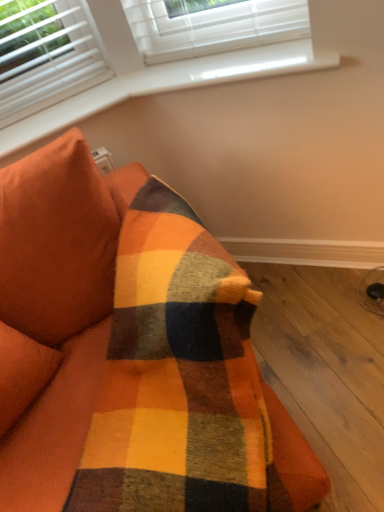
From the picture: What is the approximate width of plaid wool blanket at center?

3.43 feet.

The height and width of the screenshot is (512, 384). In order to click on plaid wool blanket at center in this screenshot , I will do `click(136, 352)`.

Measure the distance between point (88, 331) and camera.

The depth of point (88, 331) is 1.20 meters.

What is the approximate height of plaid wool blanket at center?

It is 34.29 inches.

What do you see at coordinates (136, 352) in the screenshot? The image size is (384, 512). I see `plaid wool blanket at center` at bounding box center [136, 352].

You are a GUI agent. You are given a task and a screenshot of the screen. Output one action in this format:
    pyautogui.click(x=<x>, y=<y>)
    Task: Click on the plaid wool blanket at center
    Image resolution: width=384 pixels, height=512 pixels.
    Given the screenshot: What is the action you would take?
    pyautogui.click(x=136, y=352)